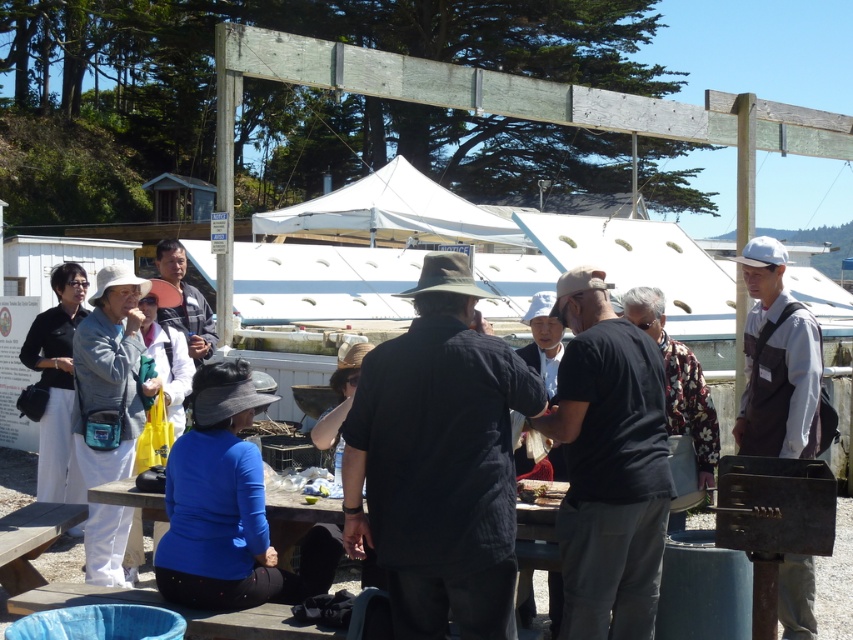
Question: Which of the following is the farthest from the observer?

Choices:
 (A) white cotton shirt at right
 (B) white fabric canopy at center
 (C) matte black jacket at center

Answer: (B)

Question: Can you confirm if white fabric canopy at center is positioned to the right of matte black jacket at center?

Choices:
 (A) yes
 (B) no

Answer: (A)

Question: Which object is positioned closest to the dark brown fabric hat at center?

Choices:
 (A) white cotton shirt at right
 (B) white fabric canopy at center

Answer: (A)

Question: Which point is farther from the camera taking this photo?

Choices:
 (A) (590, 448)
 (B) (466, 420)
 (C) (328, 220)
 (D) (173, 262)

Answer: (C)

Question: Is white fabric canopy at center above matte black jacket at center?

Choices:
 (A) no
 (B) yes

Answer: (B)

Question: Where is dark brown fabric hat at center located in relation to black cotton shirt at center in the image?

Choices:
 (A) left
 (B) right

Answer: (A)